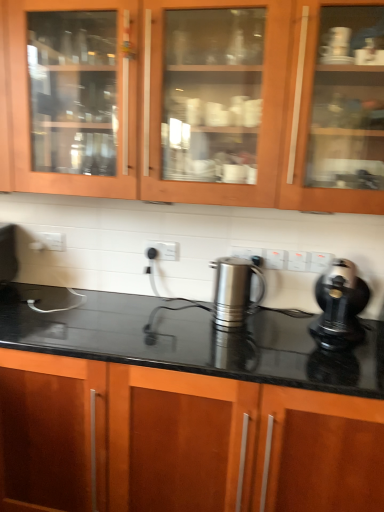
Question: From a real-world perspective, relative to matte wood cabinets at upper center, arranged as the first cabinetry when viewed from the top, is black plastic kettle at right vertically above or below?

Choices:
 (A) above
 (B) below

Answer: (B)

Question: Do you think black plastic kettle at right is within matte wood cabinets at upper center, arranged as the first cabinetry when viewed from the top, or outside of it?

Choices:
 (A) inside
 (B) outside

Answer: (B)

Question: Estimate the real-world distances between objects in this image. Which object is farther from the black plastic kettle at right?

Choices:
 (A) matte wood cabinets at upper center, acting as the 2th cabinetry starting from the bottom
 (B) polished stainless steel kettle at center
 (C) black glossy countertop at center, arranged as the second cabinetry when viewed from the top

Answer: (A)

Question: Which is nearer to the black plastic kettle at right?

Choices:
 (A) black glossy countertop at center, which is the first cabinetry from bottom to top
 (B) polished stainless steel kettle at center
 (C) matte wood cabinets at upper center, acting as the 2th cabinetry starting from the bottom

Answer: (B)